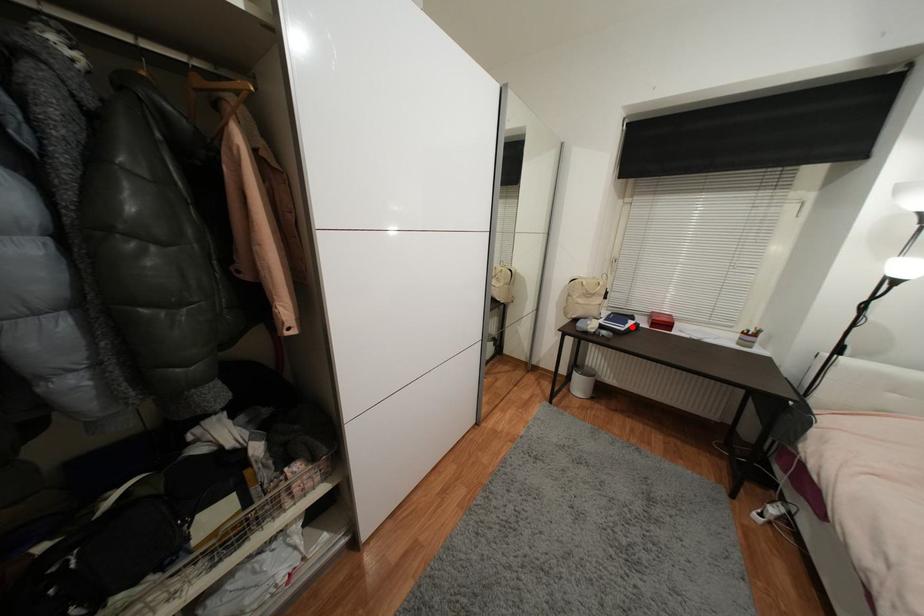
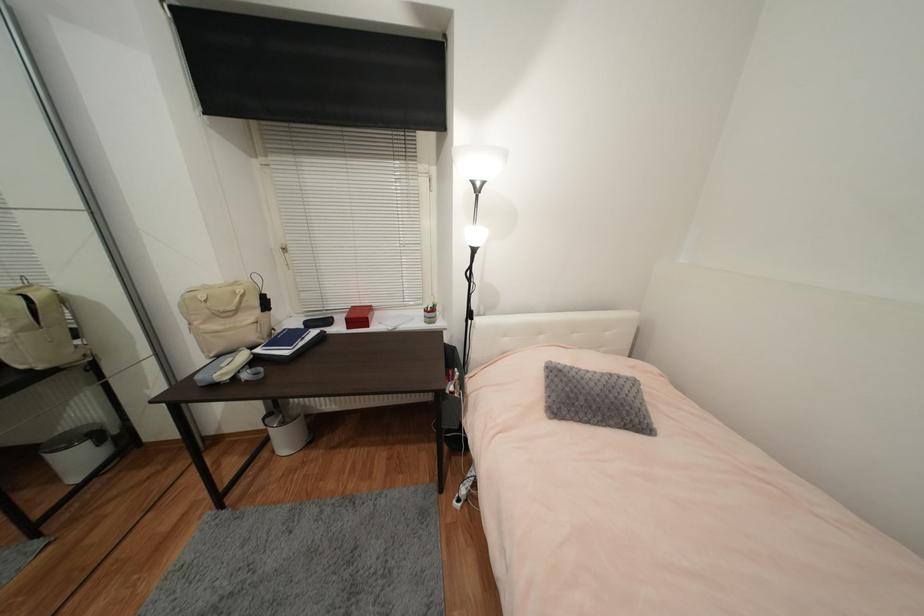
Locate, in the second image, the point that corresponds to the highlighted location in the first image.

(306, 344)